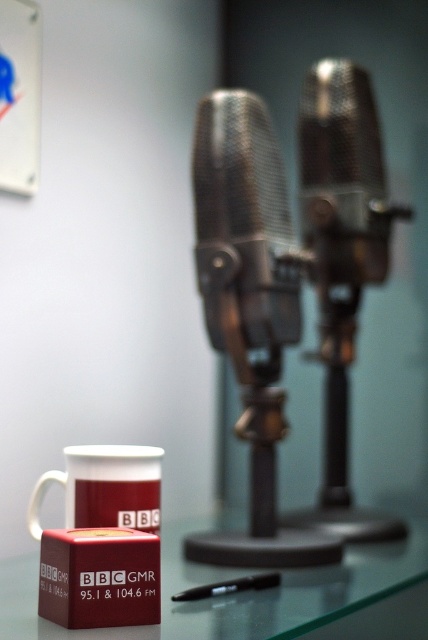
You are a technician who needs to place a 10 inch long cable between the transparent glass table at lower center and the matte cardboard box at lower left. Is there enough space for the cable to fit between them?

The distance between the transparent glass table at lower center and the matte cardboard box at lower left is 8.06 inches. Since the cable is 10 inches long, it will not fit between them as the distance is shorter than the cable length.

You are an assistant organizing items in a radio station studio. You need to place a new item between the matte cardboard box at lower left and the white ceramic mug at lower left. Is there enough space between them for a 10 cm wide item?

The matte cardboard box at lower left is to the right of the white ceramic mug at lower left. Since the box is positioned to the right of the mug, there is space between them. However, the exact distance isn not provided, so we cannot confirm if it is exactly 10 cm. But since they are separate objects, there is some space available.

You are organizing items on the transparent glass table at lower center and the matte cardboard box at lower left. Which surface can accommodate a large stack of papers without bending?

The transparent glass table at lower center can accommodate a large stack of papers without bending because it is larger in size than the matte cardboard box at lower left.